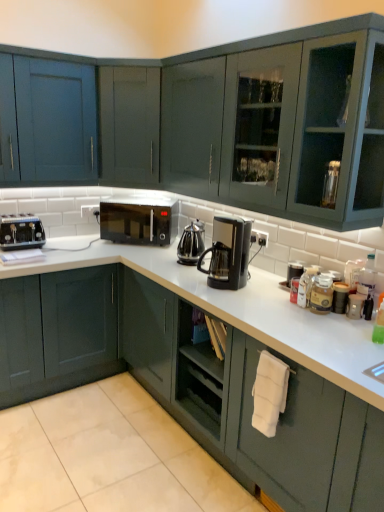
Find the location of `free point below black plastic coffee maker at center (from a real-world perspective)`. free point below black plastic coffee maker at center (from a real-world perspective) is located at coordinates (238, 285).